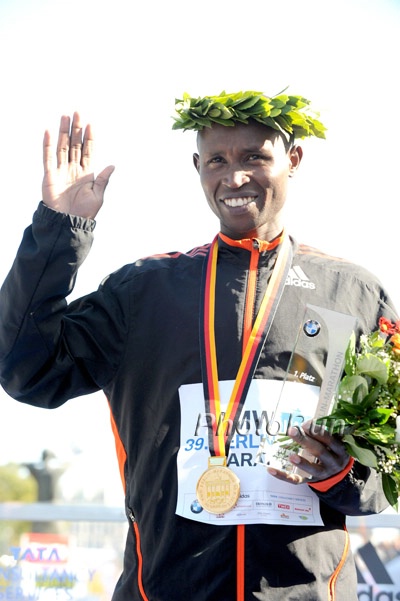
Where is `trophy`? This screenshot has height=601, width=400. trophy is located at coordinates (302, 371).